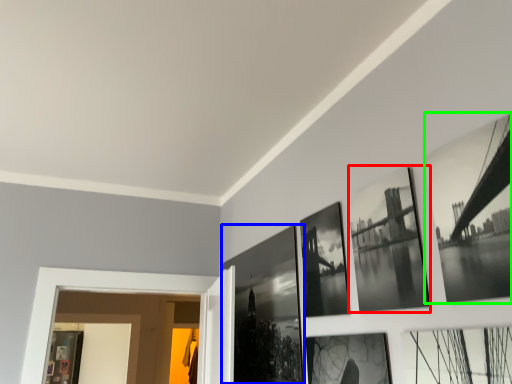
Question: Considering the real-world distances, which object is farthest from picture frame (highlighted by a red box)? picture frame (highlighted by a blue box) or picture frame (highlighted by a green box)?

Choices:
 (A) picture frame
 (B) picture frame

Answer: (A)